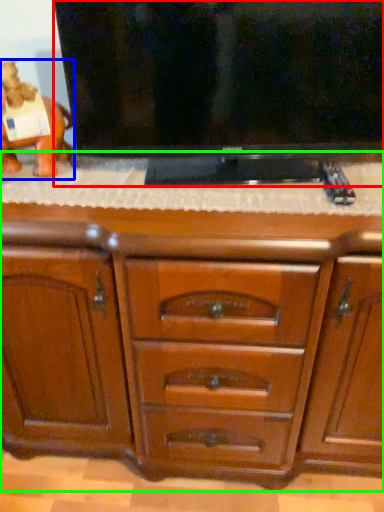
Question: Which object is positioned closest to television (highlighted by a red box)? Select from animal (highlighted by a blue box) and chest of drawers (highlighted by a green box).

Choices:
 (A) animal
 (B) chest of drawers

Answer: (B)